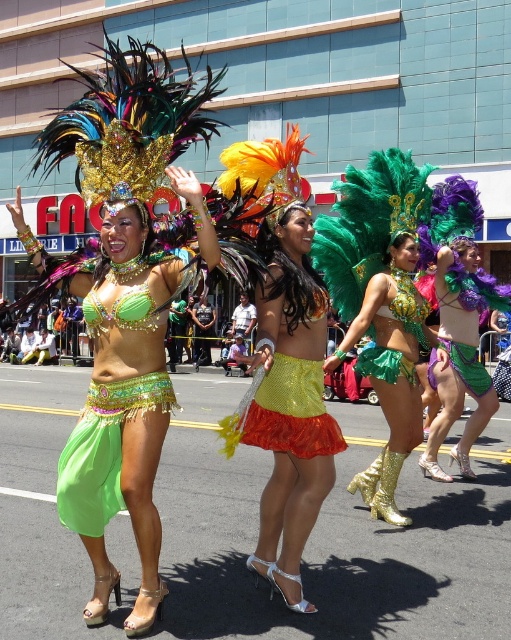
Question: Is shiny gold boots at center thinner than shiny green fabric skirt at center?

Choices:
 (A) no
 (B) yes

Answer: (A)

Question: Is shiny purple fabric skirt at center positioned before shiny green skirt at center?

Choices:
 (A) yes
 (B) no

Answer: (A)

Question: Which object appears farthest from the camera in this image?

Choices:
 (A) shiny gold boots at center
 (B) shiny green fabric skirt at center
 (C) shiny sequined skirt at center

Answer: (B)

Question: Which of the following is the farthest from the observer?

Choices:
 (A) shiny gold boots at center
 (B) shiny purple fabric skirt at center
 (C) shiny green skirt at center
 (D) green sequined skirt at center

Answer: (C)

Question: Which object appears farthest from the camera in this image?

Choices:
 (A) shiny gold boots at center
 (B) shiny purple fabric skirt at center
 (C) green sequined skirt at center

Answer: (B)

Question: Can you confirm if green sequined skirt at center is bigger than shiny green skirt at center?

Choices:
 (A) no
 (B) yes

Answer: (B)